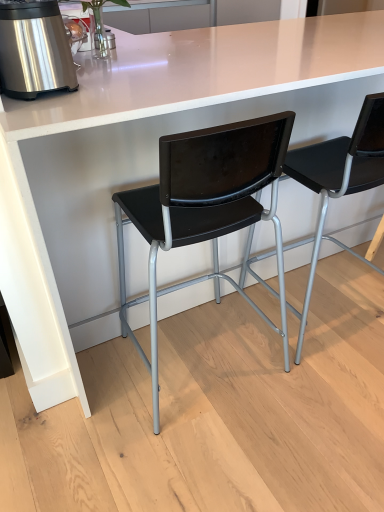
You are a GUI agent. You are given a task and a screenshot of the screen. Output one action in this format:
    pyautogui.click(x=<x>, y=<y>)
    Task: Click on the empty space that is in between black plastic chair at center, positioned as the second chair in left-to-right order, and black plastic chair at center, which is counted as the 2th chair, starting from the right
    This screenshot has width=384, height=512.
    Given the screenshot: What is the action you would take?
    pyautogui.click(x=265, y=333)